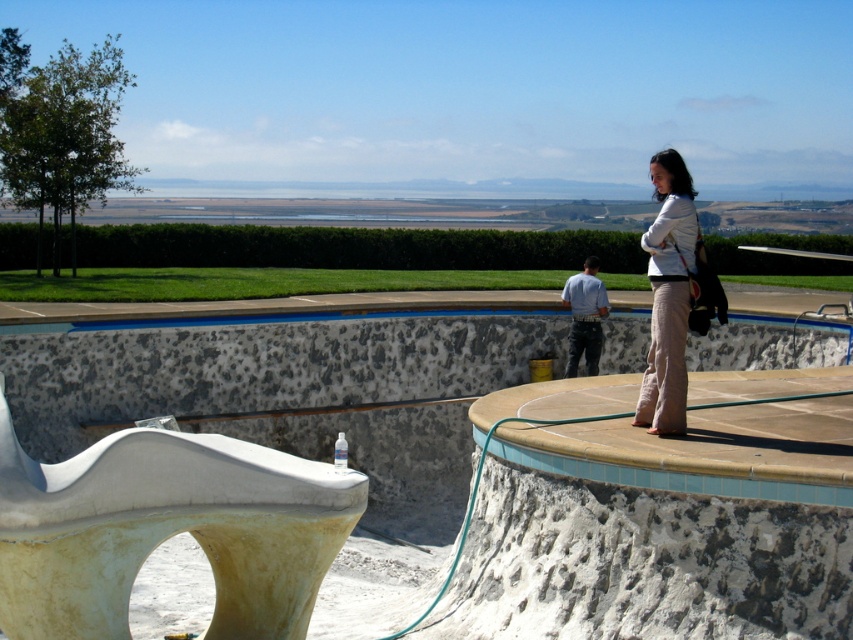
Question: Estimate the real-world distances between objects in this image. Which object is farther from the blue cotton shirt at center?

Choices:
 (A) white concrete sculpture at lower left
 (B) light beige pants at center

Answer: (A)

Question: Can you confirm if white concrete sculpture at lower left is positioned to the right of blue cotton shirt at center?

Choices:
 (A) yes
 (B) no

Answer: (B)

Question: Which of the following is the farthest from the observer?

Choices:
 (A) (146, 556)
 (B) (653, 403)

Answer: (B)

Question: Which point is closer to the camera taking this photo?

Choices:
 (A) (572, 326)
 (B) (680, 177)

Answer: (B)

Question: Is white concrete sculpture at lower left further to the viewer compared to blue cotton shirt at center?

Choices:
 (A) no
 (B) yes

Answer: (A)

Question: Can you confirm if white concrete sculpture at lower left is smaller than blue cotton shirt at center?

Choices:
 (A) no
 (B) yes

Answer: (A)